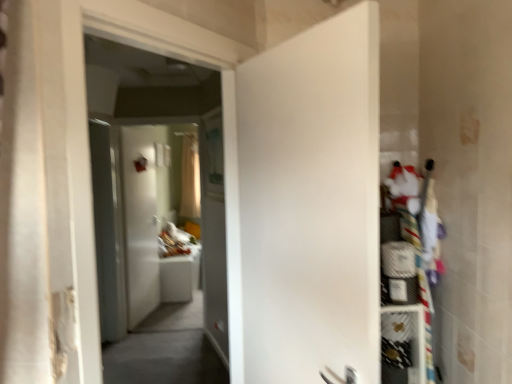
This screenshot has width=512, height=384. Find the location of `translucent fabric curtain at center`. translucent fabric curtain at center is located at coordinates (190, 178).

What do you see at coordinates (409, 200) in the screenshot? I see `white fabric shelf at right, the first shelf in the top-to-bottom sequence` at bounding box center [409, 200].

Image resolution: width=512 pixels, height=384 pixels. Find the location of `white fabric shelf at right, the first shelf in the top-to-bottom sequence`. white fabric shelf at right, the first shelf in the top-to-bottom sequence is located at coordinates (409, 200).

In order to face white mesh shelf at right, which ranks as the second shelf in top-to-bottom order, should I rotate leftwards or rightwards?

You should rotate right by 17.838 degrees.

The width and height of the screenshot is (512, 384). I want to click on white glossy door at center, the 2th door from the right, so click(140, 220).

At what (x,y) coordinates should I click in order to perform the action: click on transparent glass screen door at left. Please return your answer as a coordinate pair (x, y). Looking at the image, I should click on (109, 228).

From the image's perspective, is white glossy door at center, positioned as the first door in back-to-front order, over white fabric shelf at right, the second shelf positioned from the bottom?

Yes.

Which of these two, white glossy door at center, acting as the 2th door starting from the front, or white fabric shelf at right, the first shelf in the top-to-bottom sequence, is bigger?

Bigger between the two is white glossy door at center, acting as the 2th door starting from the front.

Considering the sizes of objects white glossy door at center, positioned as the first door in back-to-front order, and white fabric shelf at right, the second shelf positioned from the bottom, in the image provided, who is shorter, white glossy door at center, positioned as the first door in back-to-front order, or white fabric shelf at right, the second shelf positioned from the bottom,?

white fabric shelf at right, the second shelf positioned from the bottom, is shorter.

Is white mesh shelf at right, which ranks as the second shelf in top-to-bottom order, at the left side of white matte door at center, placed as the 1th door when sorted from right to left?

No.

Looking at the image, does white mesh shelf at right, the first shelf in the bottom-to-top sequence, seem bigger or smaller compared to white matte door at center, marked as the first door in a front-to-back arrangement?

In the image, white mesh shelf at right, the first shelf in the bottom-to-top sequence, appears to be smaller than white matte door at center, marked as the first door in a front-to-back arrangement.

Measure the distance between white mesh shelf at right, which ranks as the second shelf in top-to-bottom order, and white matte door at center, placed as the 1th door when sorted from right to left.

white mesh shelf at right, which ranks as the second shelf in top-to-bottom order, and white matte door at center, placed as the 1th door when sorted from right to left, are 22.98 inches apart from each other.

Does white mesh shelf at right, the first shelf in the bottom-to-top sequence, turn towards white matte door at center, which is the 2th door in back-to-front order?

No, white mesh shelf at right, the first shelf in the bottom-to-top sequence, is not aimed at white matte door at center, which is the 2th door in back-to-front order.

Identify the location of curtain that appears above the white glossy door at center, the 2th door from the right (from the image's perspective). The height and width of the screenshot is (384, 512). 190,178.

Consider the image. Is translucent fabric curtain at center turned away from white glossy door at center, the 2th door from the right?

No.

Between translucent fabric curtain at center and white glossy door at center, the 2th door from the right, which one has more height?

Standing taller between the two is white glossy door at center, the 2th door from the right.

Is translucent fabric curtain at center at the left side of white glossy door at center, the 2th door from the right?

In fact, translucent fabric curtain at center is to the right of white glossy door at center, the 2th door from the right.

From the image's perspective, which one is positioned higher, white matte door at center, which is the 2th door in back-to-front order, or transparent glass screen door at left?

From the image's view, white matte door at center, which is the 2th door in back-to-front order, is above.

This screenshot has width=512, height=384. In the image, there is a white matte door at center, which is the 2th door in back-to-front order. What are the coordinates of `screen door below it (from a real-world perspective)` in the screenshot? It's located at (109, 228).

Between point (330, 330) and point (109, 290), which one is positioned in front?

The point (330, 330) is in front.

Is white matte door at center, which is the 2th door in back-to-front order, oriented towards transparent glass screen door at left?

No, white matte door at center, which is the 2th door in back-to-front order, is not oriented towards transparent glass screen door at left.

Does point (391, 335) lie in front of point (181, 209)?

Yes.

Is white mesh shelf at right, which ranks as the second shelf in top-to-bottom order, turned away from translucent fabric curtain at center?

Yes.

From the image's perspective, is white mesh shelf at right, which ranks as the second shelf in top-to-bottom order, positioned above or below translucent fabric curtain at center?

white mesh shelf at right, which ranks as the second shelf in top-to-bottom order, is below translucent fabric curtain at center.

Between white mesh shelf at right, the first shelf in the bottom-to-top sequence, and translucent fabric curtain at center, which one has larger size?

With larger size is translucent fabric curtain at center.

From the image's perspective, between transparent glass screen door at left and translucent fabric curtain at center, who is located below?

transparent glass screen door at left is shown below in the image.

Is point (120, 305) farther from camera compared to point (190, 153)?

No, (120, 305) is in front of (190, 153).

Between transparent glass screen door at left and translucent fabric curtain at center, which one is positioned in front?

transparent glass screen door at left is in front.

Find the location of a particular element. screen door below the translucent fabric curtain at center (from a real-world perspective) is located at coordinates (109, 228).

Considering the sizes of white fabric shelf at right, the second shelf positioned from the bottom, and translucent fabric curtain at center in the image, is white fabric shelf at right, the second shelf positioned from the bottom, taller or shorter than translucent fabric curtain at center?

Considering their sizes, white fabric shelf at right, the second shelf positioned from the bottom, has less height than translucent fabric curtain at center.

In the image, is white fabric shelf at right, the second shelf positioned from the bottom, positioned in front of or behind translucent fabric curtain at center?

In the image, white fabric shelf at right, the second shelf positioned from the bottom, appears in front of translucent fabric curtain at center.

Is point (425, 179) closer or farther from the camera than point (195, 189)?

Point (425, 179) appears to be closer to the viewer than point (195, 189).

Is white fabric shelf at right, the second shelf positioned from the bottom, at the right side of translucent fabric curtain at center?

Indeed, white fabric shelf at right, the second shelf positioned from the bottom, is positioned on the right side of translucent fabric curtain at center.

The image size is (512, 384). Find the location of `shelf that is the 2nd one when counting forward from the white glossy door at center, acting as the 2th door starting from the front`. shelf that is the 2nd one when counting forward from the white glossy door at center, acting as the 2th door starting from the front is located at coordinates (409, 200).

From a real-world perspective, count 2nd doors upward from the white mesh shelf at right, which ranks as the second shelf in top-to-bottom order, and point to it. Please provide its 2D coordinates.

[(309, 206)]

From the image, which object appears to be farther from translucent fabric curtain at center, transparent glass screen door at left or white mesh shelf at right, the first shelf in the bottom-to-top sequence?

Based on the image, white mesh shelf at right, the first shelf in the bottom-to-top sequence, appears to be further to translucent fabric curtain at center.

Looking at the image, which one is located further to translucent fabric curtain at center, white matte door at center, placed as the 1th door when sorted from right to left, or white glossy door at center, acting as the 2th door starting from the front?

Based on the image, white matte door at center, placed as the 1th door when sorted from right to left, appears to be further to translucent fabric curtain at center.

Based on their spatial positions, is white glossy door at center, acting as the 2th door starting from the front, or white fabric shelf at right, the first shelf in the top-to-bottom sequence, closer to transparent glass screen door at left?

white glossy door at center, acting as the 2th door starting from the front, lies closer to transparent glass screen door at left than the other object.

Which object lies nearer to the anchor point white mesh shelf at right, which ranks as the second shelf in top-to-bottom order, white matte door at center, marked as the first door in a front-to-back arrangement, or transparent glass screen door at left?

The object closer to white mesh shelf at right, which ranks as the second shelf in top-to-bottom order, is white matte door at center, marked as the first door in a front-to-back arrangement.

Looking at the image, which one is located closer to white matte door at center, marked as the 2th door in a left-to-right arrangement, translucent fabric curtain at center or white mesh shelf at right, which ranks as the second shelf in top-to-bottom order?

white mesh shelf at right, which ranks as the second shelf in top-to-bottom order, is closer to white matte door at center, marked as the 2th door in a left-to-right arrangement.

Which object lies nearer to the anchor point translucent fabric curtain at center, white fabric shelf at right, the first shelf in the top-to-bottom sequence, or white matte door at center, marked as the 2th door in a left-to-right arrangement?

white fabric shelf at right, the first shelf in the top-to-bottom sequence, is positioned closer to the anchor translucent fabric curtain at center.

Estimate the real-world distances between objects in this image. Which object is further from white fabric shelf at right, the first shelf in the top-to-bottom sequence, white glossy door at center, acting as the 2th door starting from the front, or white mesh shelf at right, the first shelf in the bottom-to-top sequence?

white glossy door at center, acting as the 2th door starting from the front, is positioned further to the anchor white fabric shelf at right, the first shelf in the top-to-bottom sequence.

Considering their positions, is white glossy door at center, the 2th door from the right, positioned further to white matte door at center, which is the 2th door in back-to-front order, than transparent glass screen door at left?

white glossy door at center, the 2th door from the right, is positioned further to the anchor white matte door at center, which is the 2th door in back-to-front order.

The image size is (512, 384). I want to click on shelf between white fabric shelf at right, the first shelf in the top-to-bottom sequence, and translucent fabric curtain at center from front to back, so click(x=404, y=341).

Where is `screen door between white fabric shelf at right, the first shelf in the top-to-bottom sequence, and white glossy door at center, acting as the 2th door starting from the front, along the z-axis`? This screenshot has height=384, width=512. screen door between white fabric shelf at right, the first shelf in the top-to-bottom sequence, and white glossy door at center, acting as the 2th door starting from the front, along the z-axis is located at coordinates (109, 228).

Locate an element on the screen. door positioned between white fabric shelf at right, the second shelf positioned from the bottom, and translucent fabric curtain at center from near to far is located at coordinates (140, 220).

The height and width of the screenshot is (384, 512). Find the location of `screen door located between white matte door at center, placed as the 1th door when sorted from right to left, and white glossy door at center, acting as the 2th door starting from the front, in the depth direction`. screen door located between white matte door at center, placed as the 1th door when sorted from right to left, and white glossy door at center, acting as the 2th door starting from the front, in the depth direction is located at coordinates (109, 228).